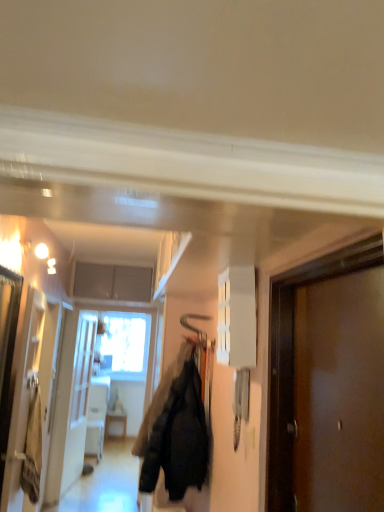
Measure the distance between white glossy cabinet at upper center and camera.

white glossy cabinet at upper center is 1.84 meters away from camera.

Measure the distance between brown matte door at right and camera.

brown matte door at right and camera are 1.10 meters apart.

Where is `brown matte door at right`? Image resolution: width=384 pixels, height=512 pixels. brown matte door at right is located at coordinates (293, 358).

Locate an element on the screen. This screenshot has width=384, height=512. white glossy cabinet at upper center is located at coordinates (237, 317).

Is the position of velvet black jacket at center less distant than that of white glossy cabinet at upper center?

No, the depth of velvet black jacket at center is greater than that of white glossy cabinet at upper center.

From a real-world perspective, is velvet black jacket at center physically below white glossy cabinet at upper center?

Yes, from a real-world perspective, velvet black jacket at center is beneath white glossy cabinet at upper center.

Choose the correct answer: Is velvet black jacket at center inside white glossy cabinet at upper center or outside it?

velvet black jacket at center cannot be found inside white glossy cabinet at upper center.

How distant is velvet black jacket at center from white glossy cabinet at upper center?

A distance of 3.41 feet exists between velvet black jacket at center and white glossy cabinet at upper center.

Can you confirm if white glossy cabinet at upper center is wider than brown matte door at right?

In fact, white glossy cabinet at upper center might be narrower than brown matte door at right.

In the scene shown: Considering the sizes of objects white glossy cabinet at upper center and brown matte door at right in the image provided, who is taller, white glossy cabinet at upper center or brown matte door at right?

Standing taller between the two is brown matte door at right.

Is point (227, 312) more distant than point (281, 506)?

Yes, it is behind point (281, 506).

Is brown matte door at right aimed at velvet black jacket at center?

No, brown matte door at right is not facing towards velvet black jacket at center.

Is brown matte door at right bigger than velvet black jacket at center?

Incorrect, brown matte door at right is not larger than velvet black jacket at center.

Is brown matte door at right thinner than velvet black jacket at center?

Indeed, brown matte door at right has a lesser width compared to velvet black jacket at center.

Is there a large distance between brown matte door at right and velvet black jacket at center?

That's right, there is a large distance between brown matte door at right and velvet black jacket at center.

From the image's perspective, would you say white glossy cabinet at upper center is shown under velvet black jacket at center?

Actually, white glossy cabinet at upper center appears above velvet black jacket at center in the image.

Considering the sizes of objects white glossy cabinet at upper center and velvet black jacket at center in the image provided, who is smaller, white glossy cabinet at upper center or velvet black jacket at center?

Smaller between the two is white glossy cabinet at upper center.

Does white glossy cabinet at upper center come in front of velvet black jacket at center?

That is True.

Does point (227, 295) come in front of point (181, 432)?

That is True.

Which is closer, (x=177, y=478) or (x=328, y=256)?

The point (x=328, y=256) is closer to the camera.

Is velvet black jacket at center facing towards brown matte door at right?

No, velvet black jacket at center is not turned towards brown matte door at right.

From a real-world perspective, relative to brown matte door at right, is velvet black jacket at center vertically above or below?

Clearly, from a real-world perspective, velvet black jacket at center is below brown matte door at right.

Locate an element on the screen. The height and width of the screenshot is (512, 384). door above the velvet black jacket at center (from a real-world perspective) is located at coordinates (293, 358).

Is brown matte door at right placed right next to white glossy cabinet at upper center?

No, brown matte door at right is not beside white glossy cabinet at upper center.

Which is closer, (289, 314) or (225, 321)?

Point (289, 314)

Which of these two, brown matte door at right or white glossy cabinet at upper center, stands shorter?

white glossy cabinet at upper center is shorter.

Is brown matte door at right to the left of white glossy cabinet at upper center from the viewer's perspective?

Incorrect, brown matte door at right is not on the left side of white glossy cabinet at upper center.

Locate an element on the screen. The height and width of the screenshot is (512, 384). cabinetry in front of the velvet black jacket at center is located at coordinates (237, 317).

I want to click on door below the white glossy cabinet at upper center (from the image's perspective), so click(293, 358).

From the image, which object appears to be farther from velvet black jacket at center, white glossy cabinet at upper center or brown matte door at right?

brown matte door at right lies further to velvet black jacket at center than the other object.

Looking at the image, which one is located further to white glossy cabinet at upper center, velvet black jacket at center or brown matte door at right?

Among the two, velvet black jacket at center is located further to white glossy cabinet at upper center.

When comparing their distances from brown matte door at right, does white glossy cabinet at upper center or velvet black jacket at center seem closer?

white glossy cabinet at upper center.

Based on their spatial positions, is brown matte door at right or white glossy cabinet at upper center closer to velvet black jacket at center?

Among the two, white glossy cabinet at upper center is located nearer to velvet black jacket at center.

When comparing their distances from white glossy cabinet at upper center, does brown matte door at right or velvet black jacket at center seem further?

velvet black jacket at center is further to white glossy cabinet at upper center.

From the image, which object appears to be farther from brown matte door at right, velvet black jacket at center or white glossy cabinet at upper center?

Based on the image, velvet black jacket at center appears to be further to brown matte door at right.

This screenshot has height=512, width=384. I want to click on cabinetry positioned between brown matte door at right and velvet black jacket at center from near to far, so click(237, 317).